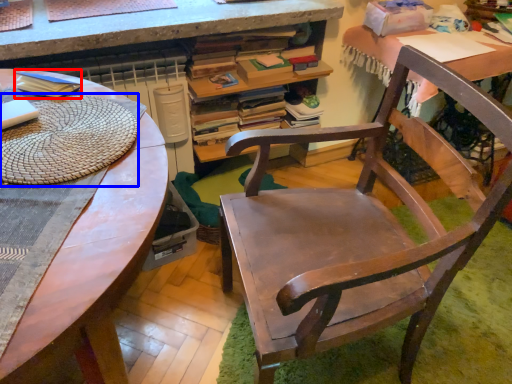
Question: Which point is further to the camera, paperback book (highlighted by a red box) or mat (highlighted by a blue box)?

Choices:
 (A) paperback book
 (B) mat

Answer: (A)